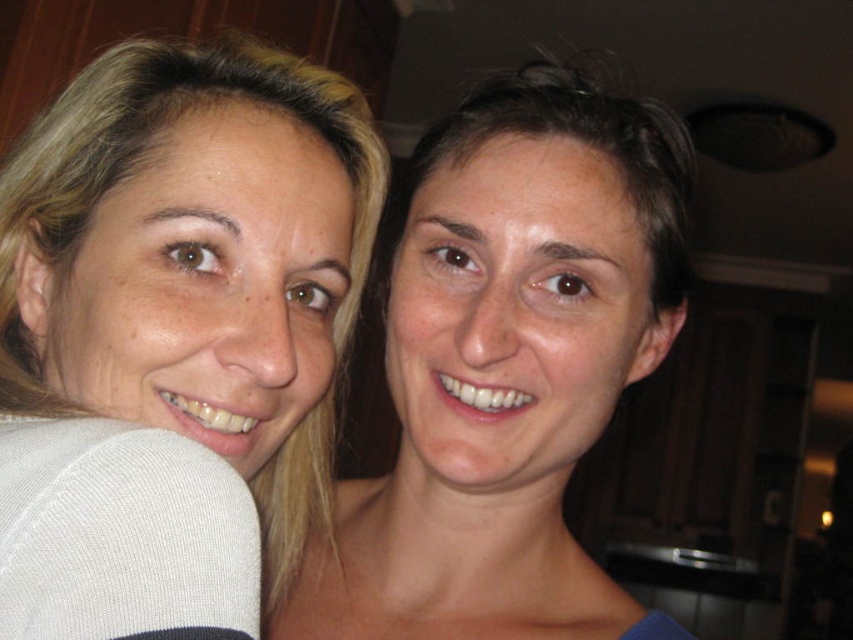
Which is in front, point (9, 515) or point (381, 280)?

Point (9, 515) is in front.

Can you confirm if blonde hair at left is positioned below smooth skin face at center?

Indeed, blonde hair at left is positioned under smooth skin face at center.

Is point (347, 330) closer to camera compared to point (546, 129)?

That is False.

Locate an element on the screen. The image size is (853, 640). blonde hair at left is located at coordinates (173, 336).